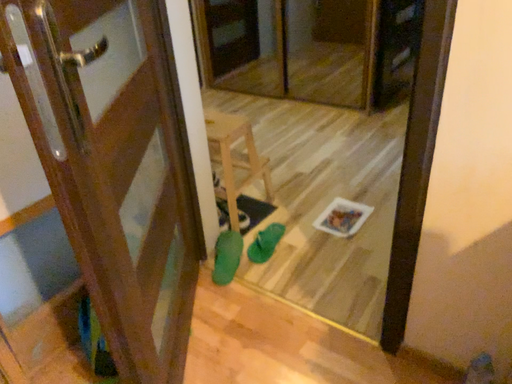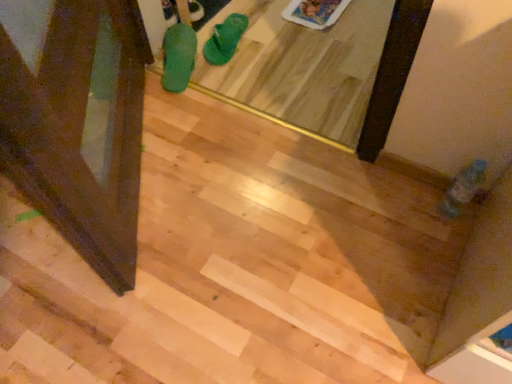
Question: How did the camera likely rotate when shooting the video?

Choices:
 (A) rotated upward
 (B) rotated downward

Answer: (B)